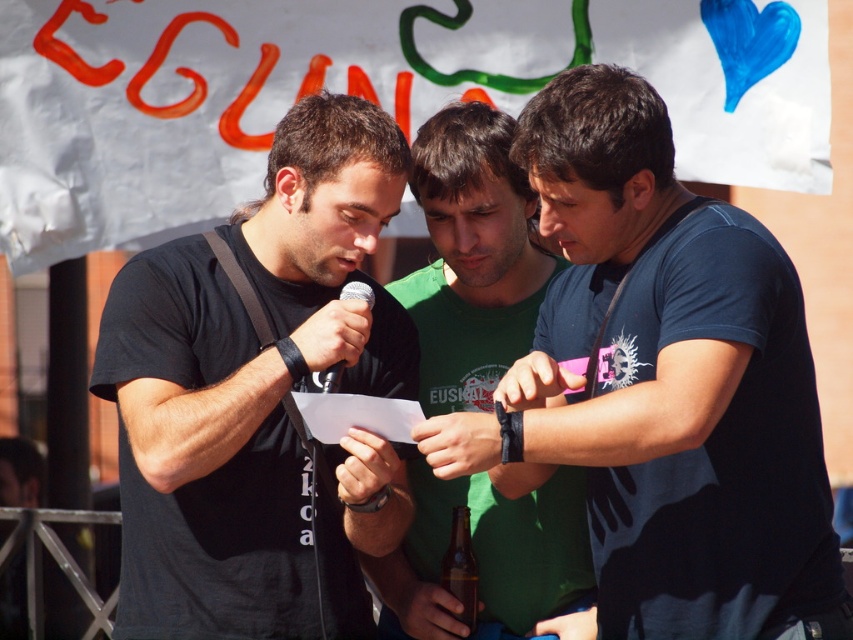
You are a photographer at the event and need to capture a clear shot of both the green cotton shirt at center and the brown glass bottle at center. Which object is closer to the camera?

The green cotton shirt at center is positioned over the brown glass bottle at center, so the green cotton shirt at center is closer to the camera.

What are the coordinates of the blue cotton shirt at center?

The coordinates of the blue cotton shirt at center are at point (662, 385).